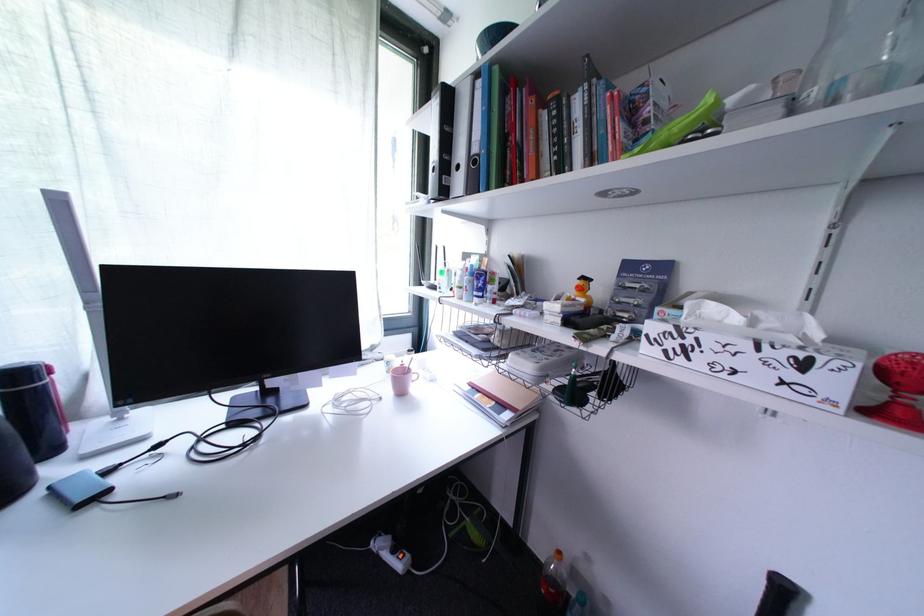
Where is `white tissue`? white tissue is located at coordinates (755, 323).